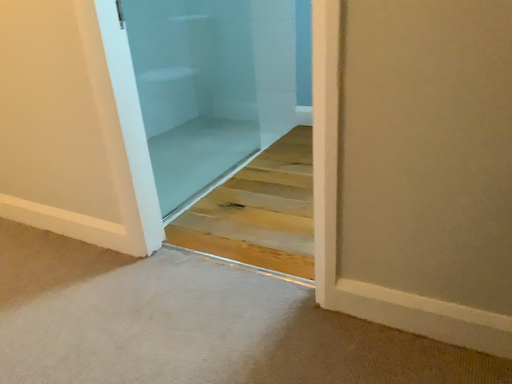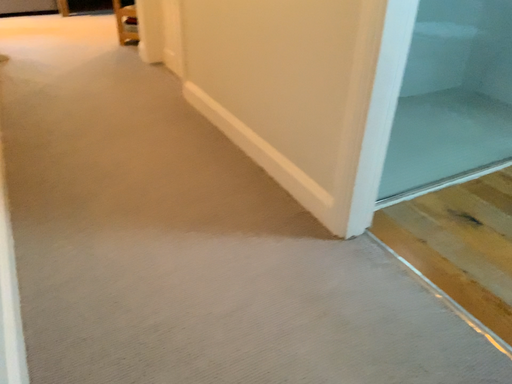
Question: How did the camera likely rotate when shooting the video?

Choices:
 (A) rotated right
 (B) rotated left

Answer: (B)